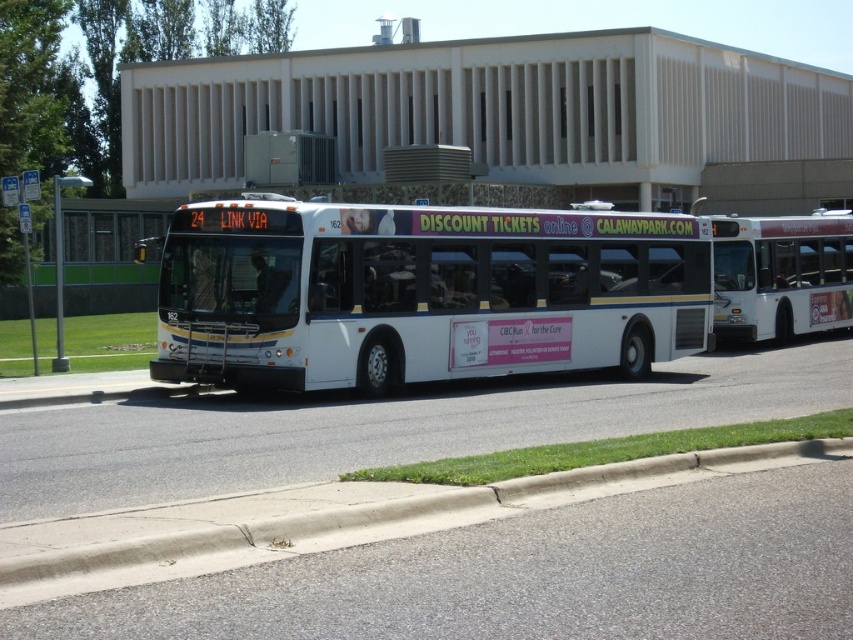
Between gray concrete curb at lower center and white matte bus at right, which one appears on the left side from the viewer's perspective?

gray concrete curb at lower center

Is gray concrete curb at lower center taller than white matte bus at right?

No, gray concrete curb at lower center is not taller than white matte bus at right.

Where is `gray concrete curb at lower center`? This screenshot has height=640, width=853. gray concrete curb at lower center is located at coordinates (325, 518).

Is white matte bus at center to the left of white matte bus at right from the viewer's perspective?

Indeed, white matte bus at center is positioned on the left side of white matte bus at right.

I want to click on white matte bus at center, so tap(422, 292).

You are a GUI agent. You are given a task and a screenshot of the screen. Output one action in this format:
    pyautogui.click(x=<x>, y=<y>)
    Task: Click on the white matte bus at center
    
    Given the screenshot: What is the action you would take?
    pyautogui.click(x=422, y=292)

Does white matte bus at center lie behind gray concrete curb at lower center?

Yes.

You are a GUI agent. You are given a task and a screenshot of the screen. Output one action in this format:
    pyautogui.click(x=<x>, y=<y>)
    Task: Click on the white matte bus at center
    
    Given the screenshot: What is the action you would take?
    pyautogui.click(x=422, y=292)